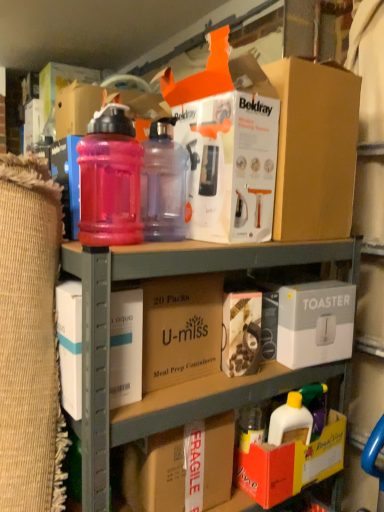
Question: Is pink plastic bottles at upper center in front of or behind translucent pink bottle at upper left, which is the second bottle in right-to-left order, in the image?

Choices:
 (A) front
 (B) behind

Answer: (A)

Question: In the image, is pink plastic bottles at upper center on the left side or the right side of translucent pink bottle at upper left, which is the second bottle in right-to-left order?

Choices:
 (A) right
 (B) left

Answer: (A)

Question: Considering the real-world distances, which object is closest to the fragile cardboard box at lower center, which appears as the 2th cardboard box when viewed from the top?

Choices:
 (A) pink translucent bottle at upper center, which is the first bottle in right-to-left order
 (B) brown cardboard at center, which is counted as the 2th cardboard box, starting from the bottom
 (C) white cardboard toaster at lower right
 (D) pink plastic bottles at upper center
 (E) white cardboard box at upper center, arranged as the 2th box when viewed from the front

Answer: (D)

Question: Based on their relative distances, which object is nearer to the fragile cardboard box at lower center, acting as the first cardboard box starting from the bottom?

Choices:
 (A) brown cardboard at center, the 1th cardboard box from the top
 (B) pink translucent bottle at upper center, which is the first bottle in right-to-left order
 (C) white cardboard box at upper center, which is counted as the first box, starting from the back
 (D) pink plastic bottles at upper center
 (E) translucent pink bottle at upper left, which is the second bottle in right-to-left order

Answer: (D)